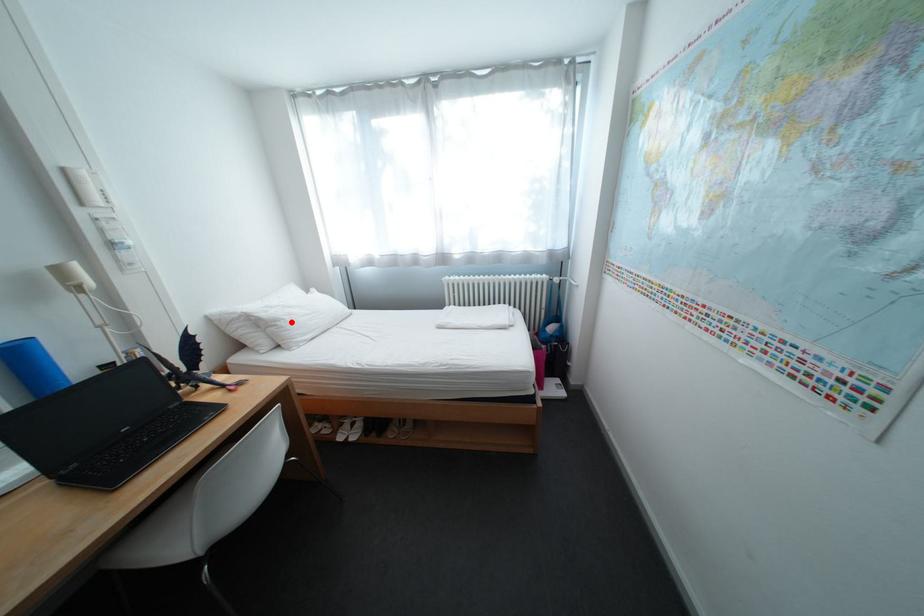
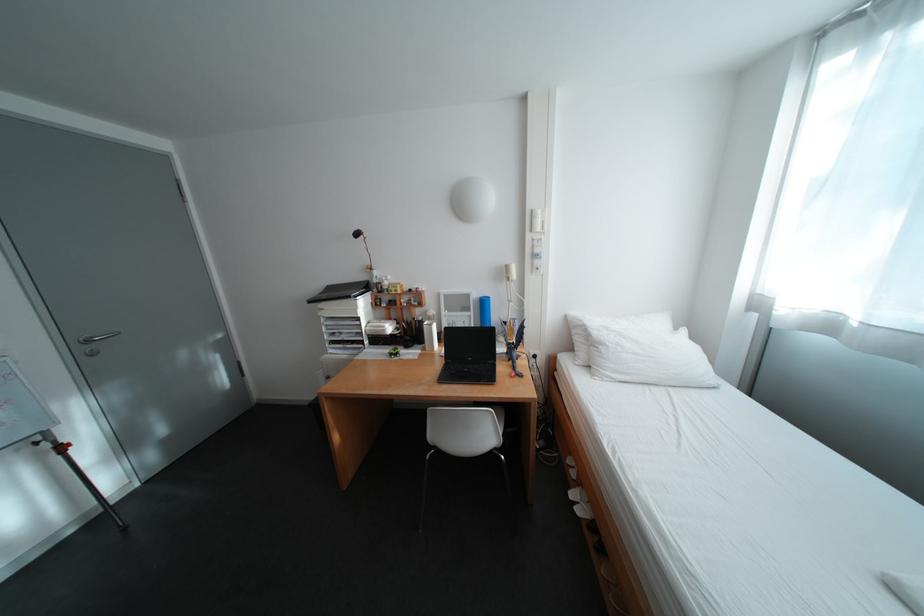
Find the pixel in the second image that matches the highlighted location in the first image.

(614, 346)